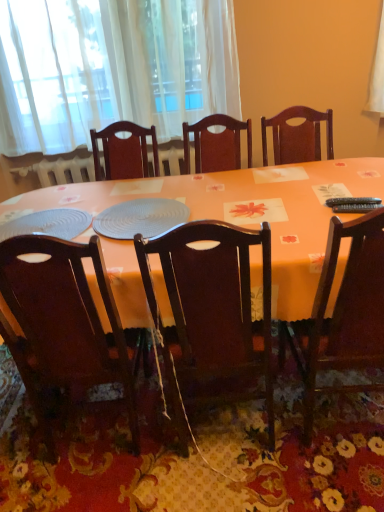
The image size is (384, 512). Find the location of `free space that is to the left of black plastic remote control at right, arranged as the first remote control when viewed from the top`. free space that is to the left of black plastic remote control at right, arranged as the first remote control when viewed from the top is located at coordinates (302, 212).